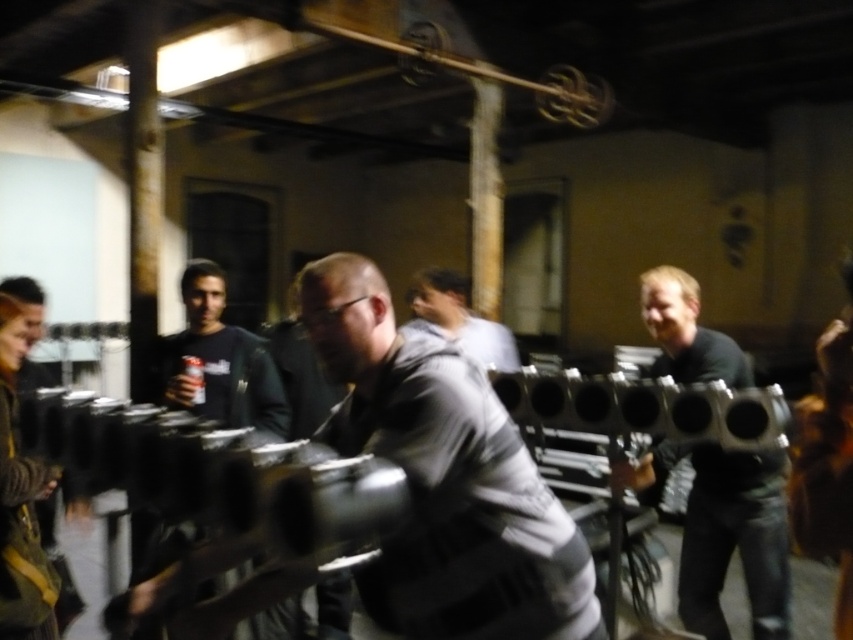
Question: Can you confirm if gray matte jacket at center is wider than gray fabric shirt at center?

Choices:
 (A) yes
 (B) no

Answer: (A)

Question: Which of the following is the farthest from the observer?

Choices:
 (A) (474, 342)
 (B) (401, 362)

Answer: (A)

Question: Estimate the real-world distances between objects in this image. Which object is closer to the black matte shirt at center?

Choices:
 (A) black matte helmet at center
 (B) gray fabric shirt at center
 (C) gray matte jacket at center

Answer: (B)

Question: Based on their relative distances, which object is nearer to the black matte shirt at center?

Choices:
 (A) gray matte jacket at center
 (B) black matte helmet at center

Answer: (B)

Question: Considering the relative positions of black matte helmet at center and gray fabric shirt at center in the image provided, where is black matte helmet at center located with respect to gray fabric shirt at center?

Choices:
 (A) below
 (B) above

Answer: (A)

Question: Does black matte helmet at center have a smaller size compared to gray fabric shirt at center?

Choices:
 (A) yes
 (B) no

Answer: (B)